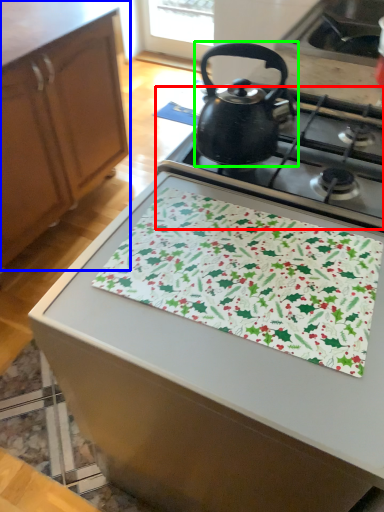
Question: Which is nearer to the gas stove (highlighted by a red box)? cabinetry (highlighted by a blue box) or kettle (highlighted by a green box).

Choices:
 (A) cabinetry
 (B) kettle

Answer: (B)